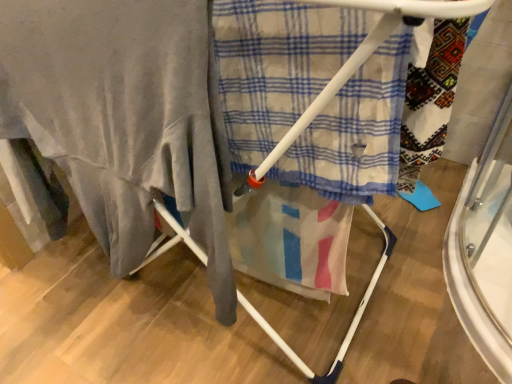
Image resolution: width=512 pixels, height=384 pixels. What are the coordinates of `free point below matte gray blanket at left (from a real-world perspective)` in the screenshot? It's located at (140, 303).